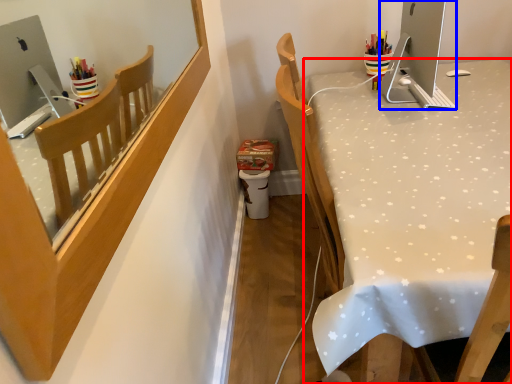
Question: Which object appears closest to the camera in this image, desk (highlighted by a red box) or desktop (highlighted by a blue box)?

Choices:
 (A) desk
 (B) desktop

Answer: (A)